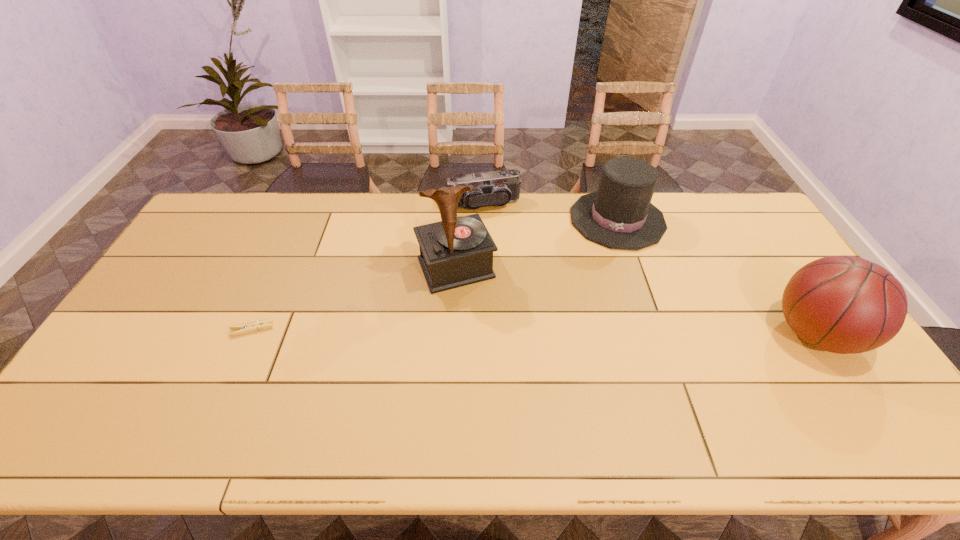
The width and height of the screenshot is (960, 540). Identify the location of free point between the third tallest object and the camcorder. (550, 212).

The height and width of the screenshot is (540, 960). What are the coordinates of `unoccupied position between the basketball and the tallest object` in the screenshot? It's located at (636, 301).

Identify the location of free spot between the tallest object and the clothespin. This screenshot has height=540, width=960. (354, 299).

The image size is (960, 540). I want to click on free space that is in between the phonograph_record and the second object from right to left, so click(537, 244).

You are a GUI agent. You are given a task and a screenshot of the screen. Output one action in this format:
    pyautogui.click(x=<x>, y=<y>)
    Task: Click on the unoccupied position between the camcorder and the clothespin
    
    Given the screenshot: What is the action you would take?
    pyautogui.click(x=368, y=267)

Find the location of a particular element. The image size is (960, 540). free space between the tallest object and the rightmost object is located at coordinates (636, 301).

The height and width of the screenshot is (540, 960). In order to click on free space between the third tallest object and the camcorder in this screenshot , I will do `click(550, 212)`.

Identify which object is located as the third nearest to the tallest object. Please provide its 2D coordinates. Your answer should be formatted as a tuple, i.e. [(x, y)], where the tuple contains the x and y coordinates of a point satisfying the conditions above.

[(250, 327)]

Locate an element on the screen. The image size is (960, 540). the fourth closest object to the basketball is located at coordinates (250, 327).